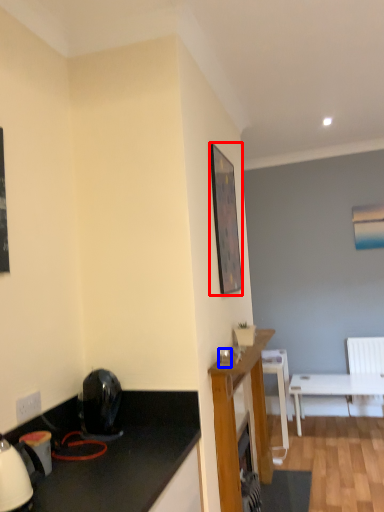
Question: Which point is closer to the camera, picture frame (highlighted by a red box) or coffee cup (highlighted by a blue box)?

Choices:
 (A) picture frame
 (B) coffee cup

Answer: (B)